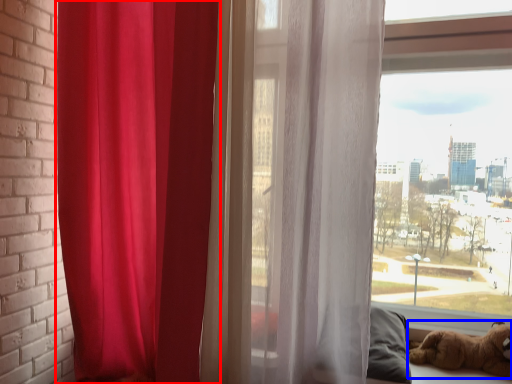
Question: Which point is closer to the camera, curtain (highlighted by a red box) or dog (highlighted by a blue box)?

Choices:
 (A) curtain
 (B) dog

Answer: (A)